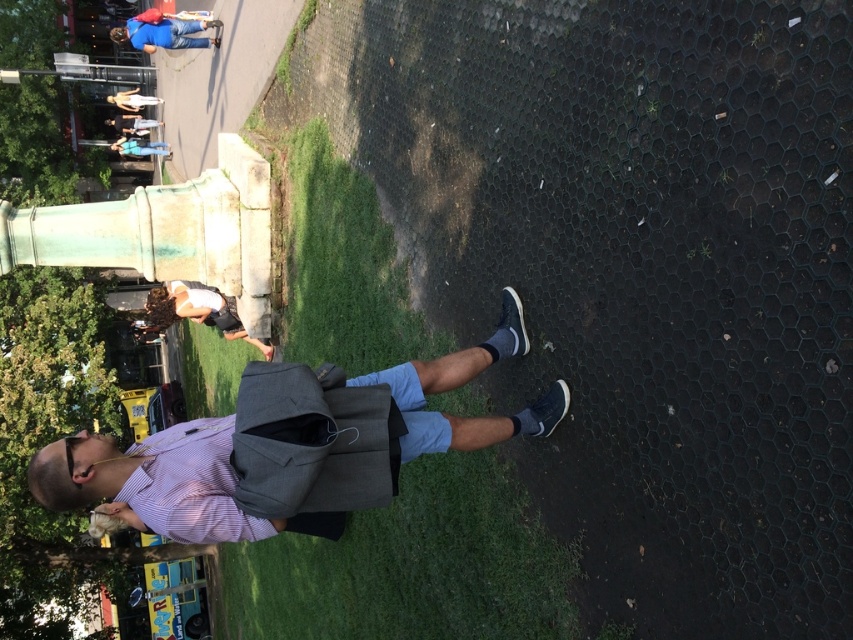
You are a photographer trying to capture the person walking away. You notice the green grass at center and the dark gray backpack at upper left in your frame. Which object is closer to the camera?

The dark gray backpack at upper left is closer to the camera because it is smaller in size compared to the green grass at center, which appears taller and thus farther away.

You are a photographer positioned at the camera location. You want to take a photo of the light blue denim shorts at upper center without the dark gray backpack at upper left blocking the view. Is this possible given their positions?

The light blue denim shorts at upper center is behind the dark gray backpack at upper left, so it is blocked from view. To capture the shorts without obstruction, you would need to reposition yourself to a different angle where the backpack does not obscure the shorts.

You are standing at the dark gray backpack at upper left and want to walk towards the green grass at center. Which direction should you move?

You should move to the right since the green grass at center is to the right of the dark gray backpack at upper left according to the description.